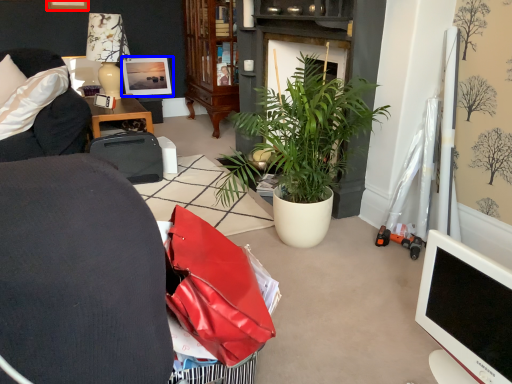
Question: Among these objects, which one is farthest to the camera, picture frame (highlighted by a red box) or picture frame (highlighted by a blue box)?

Choices:
 (A) picture frame
 (B) picture frame

Answer: (B)